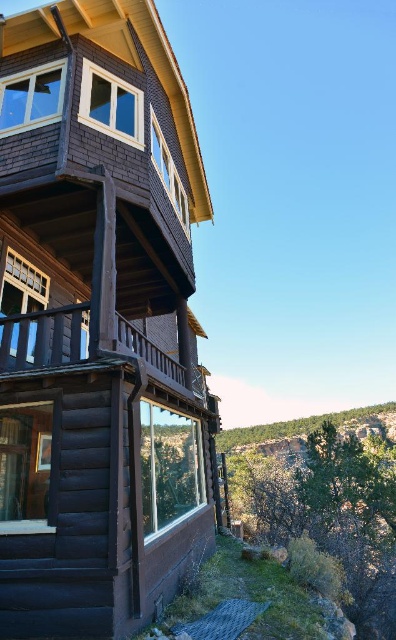
Question: In this image, where is dark brown wood cabin at left located relative to green mossy rock at lower right?

Choices:
 (A) left
 (B) right

Answer: (A)

Question: Which point appears farthest from the camera in this image?

Choices:
 (A) click(138, 356)
 (B) click(180, 444)
 (C) click(247, 429)

Answer: (C)

Question: Estimate the real-world distances between objects in this image. Which object is farther from the brown wooden balcony at upper left?

Choices:
 (A) dark brown wood cabin at left
 (B) green mossy rock at lower right

Answer: (B)

Question: Is brown wooden balcony at upper left above green mossy rock at lower right?

Choices:
 (A) no
 (B) yes

Answer: (B)

Question: Among these points, which one is farthest from the camera?

Choices:
 (A) (51, 333)
 (B) (28, 317)
 (C) (361, 406)

Answer: (C)

Question: Is brown wooden balcony at upper left thinner than green mossy rock at lower right?

Choices:
 (A) no
 (B) yes

Answer: (B)